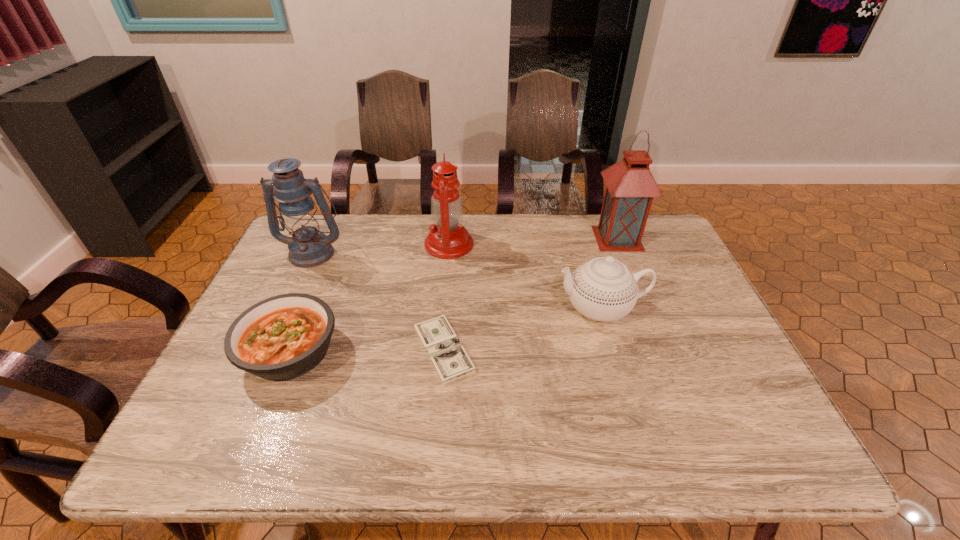
Identify the location of vacant space situated on the spout of the chinaware. Image resolution: width=960 pixels, height=540 pixels. (411, 308).

Find the location of `vacant area situated on the spout of the chinaware`. vacant area situated on the spout of the chinaware is located at coordinates (480, 308).

At what (x,y) coordinates should I click in order to perform the action: click on vacant region located on the right of the fifth tallest object. Please return your answer as a coordinate pair (x, y). The height and width of the screenshot is (540, 960). Looking at the image, I should click on (470, 352).

This screenshot has width=960, height=540. What are the coordinates of `vacant space located on the right of the shortest object` in the screenshot? It's located at pos(530,349).

This screenshot has width=960, height=540. Identify the location of oil lamp present at the far edge. (448, 239).

At what (x,y) coordinates should I click in order to perform the action: click on lantern present at the left edge. Please return your answer as a coordinate pair (x, y). Looking at the image, I should click on (308, 247).

Where is `stew present at the left edge`? stew present at the left edge is located at coordinates (283, 337).

Where is `object situated at the right edge`? The image size is (960, 540). object situated at the right edge is located at coordinates (630, 187).

Find the location of a particular element. The width and height of the screenshot is (960, 540). object at the far left corner is located at coordinates (308, 247).

The height and width of the screenshot is (540, 960). In order to click on object that is at the far right corner in this screenshot , I will do `click(630, 187)`.